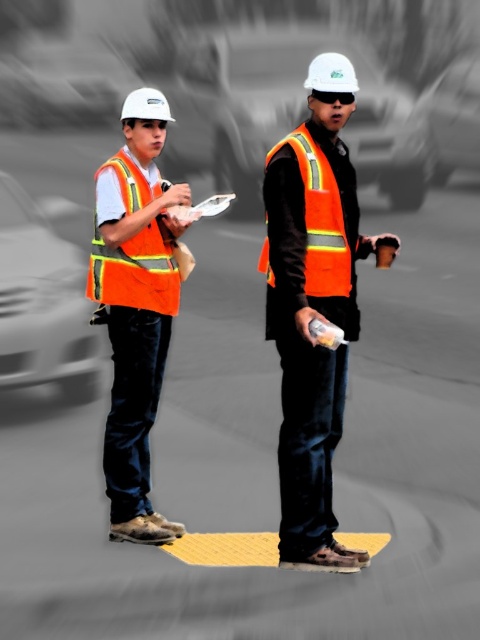
Does orange reflective vest at left lie in front of high-visibility reflective safety vest at center?

No.

Can you confirm if orange reflective vest at left is thinner than high-visibility reflective safety vest at center?

In fact, orange reflective vest at left might be wider than high-visibility reflective safety vest at center.

Which is in front, point (46, 244) or point (311, 163)?

Point (311, 163)

Where is `orange reflective vest at left`? This screenshot has width=480, height=640. orange reflective vest at left is located at coordinates (43, 304).

Is point (302, 204) positioned after point (259, 138)?

No, (302, 204) is in front of (259, 138).

Which of these two, orange reflective vest at center or metallic silver car at center, stands taller?

metallic silver car at center is taller.

Which is in front, point (282, 476) or point (229, 52)?

Positioned in front is point (282, 476).

Locate an element on the screen. This screenshot has height=640, width=480. orange reflective vest at center is located at coordinates (313, 307).

Between orange reflective vest at left and high-visibility reflective safety vest at left, which one has more height?

orange reflective vest at left is taller.

Which is above, orange reflective vest at left or high-visibility reflective safety vest at left?

Positioned higher is orange reflective vest at left.

I want to click on orange reflective vest at left, so click(x=43, y=304).